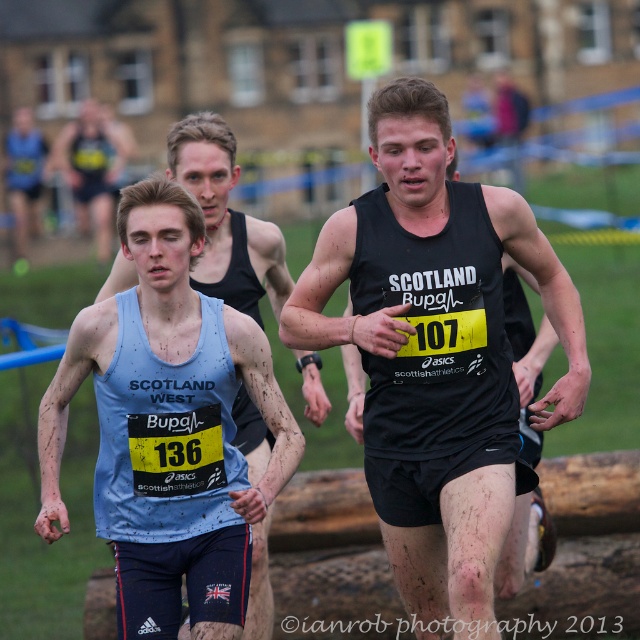
Can you confirm if light blue fabric tank top at center is shorter than matte black tank top at center?

No.

In the scene shown: Is light blue fabric tank top at center closer to camera compared to matte black tank top at center?

Yes, it is in front of matte black tank top at center.

This screenshot has height=640, width=640. I want to click on light blue fabric tank top at center, so click(x=227, y=220).

Where is `black matte tank top at center`? black matte tank top at center is located at coordinates (436, 355).

Between point (460, 230) and point (243, 301), which one is positioned behind?

Positioned behind is point (243, 301).

Between point (432, 288) and point (269, 298), which one is positioned in front?

Point (432, 288) is in front.

You are a GUI agent. You are given a task and a screenshot of the screen. Output one action in this format:
    pyautogui.click(x=<x>, y=<y>)
    Task: Click on the black matte tank top at center
    The height and width of the screenshot is (640, 640).
    Given the screenshot: What is the action you would take?
    pyautogui.click(x=436, y=355)

Who is shorter, black matte tank top at center or matte black tank top at center?

matte black tank top at center is shorter.

Measure the distance between black matte tank top at center and matte black tank top at center.

black matte tank top at center is 54.31 meters away from matte black tank top at center.

Does point (438, 108) come closer to viewer compared to point (90, 166)?

That is True.

Find the location of a particular element. This screenshot has height=640, width=640. black matte tank top at center is located at coordinates (436, 355).